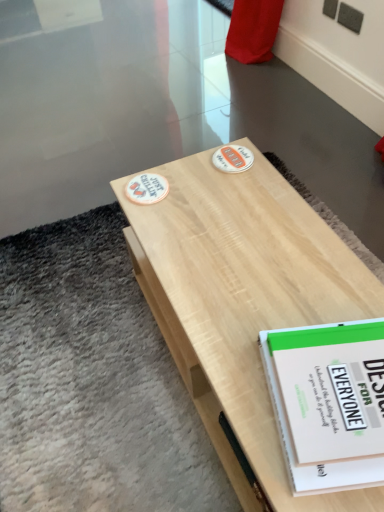
The image size is (384, 512). Find the location of `vacant space behind white paper book at center`. vacant space behind white paper book at center is located at coordinates (299, 282).